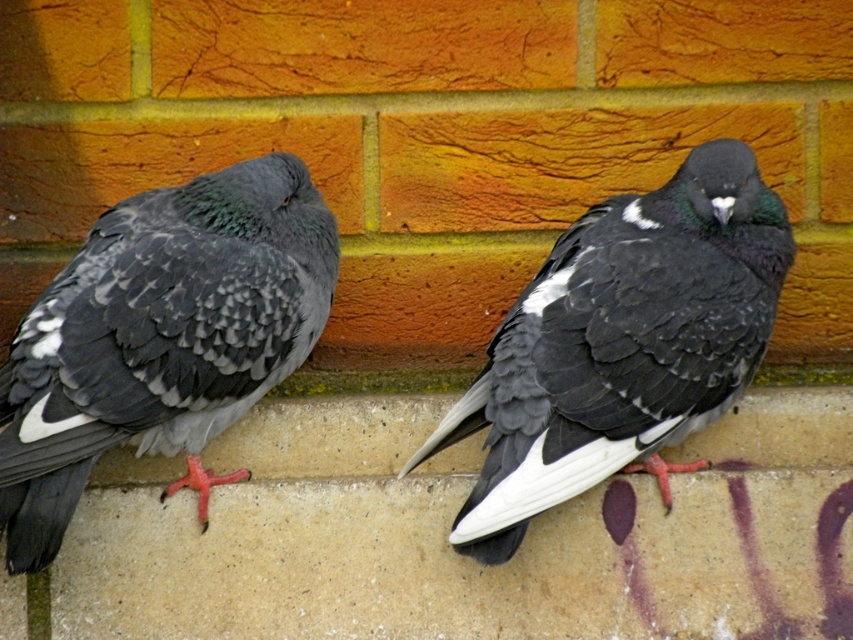
Can you confirm if concreteroughpigeons at lower center is taller than black matte pigeon at center?

Incorrect, concreteroughpigeons at lower center's height is not larger of black matte pigeon at center's.

Which is more to the left, concreteroughpigeons at lower center or black matte pigeon at center?

From the viewer's perspective, concreteroughpigeons at lower center appears more on the left side.

Does point (309, 618) come closer to viewer compared to point (628, 262)?

No.

The image size is (853, 640). Identify the location of concreteroughpigeons at lower center. (448, 529).

Looking at this image, is concreteroughpigeons at lower center to the left of matte gray pigeon at center from the viewer's perspective?

Incorrect, concreteroughpigeons at lower center is not on the left side of matte gray pigeon at center.

The width and height of the screenshot is (853, 640). What do you see at coordinates (448, 529) in the screenshot?
I see `concreteroughpigeons at lower center` at bounding box center [448, 529].

Locate an element on the screen. Image resolution: width=853 pixels, height=640 pixels. concreteroughpigeons at lower center is located at coordinates (448, 529).

Where is `concreteroughpigeons at lower center`? The image size is (853, 640). concreteroughpigeons at lower center is located at coordinates (448, 529).

Does point (49, 493) come farther from viewer compared to point (686, 163)?

No, it is in front of (686, 163).

Who is more distant from viewer, [218,212] or [485,500]?

Positioned behind is point [218,212].

The height and width of the screenshot is (640, 853). Find the location of `matte gray pigeon at center`. matte gray pigeon at center is located at coordinates (160, 337).